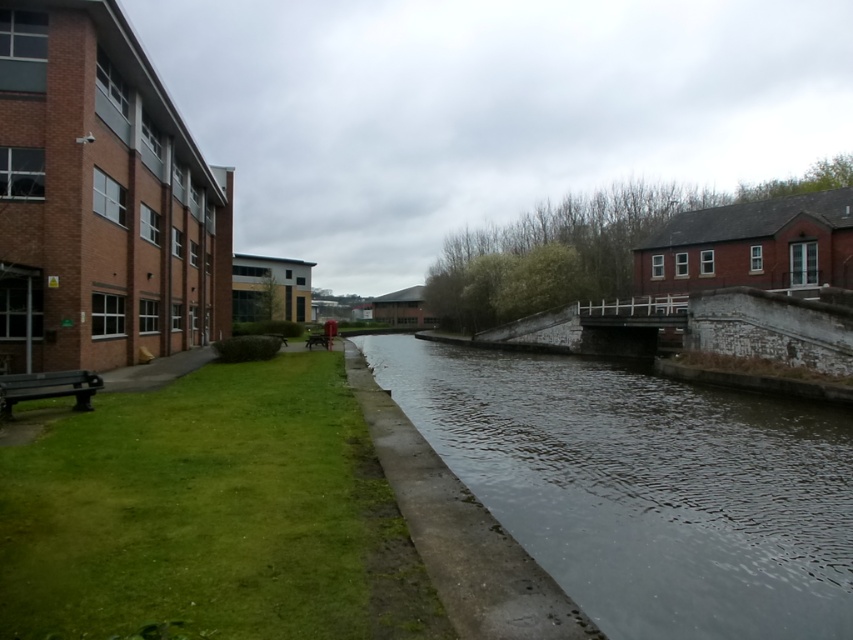
Looking at this image, you are a maintenance worker needing to cross from the green grass at lower left to the clear water at center for inspection. The bridge provided is 6 meters long. Will the bridge be sufficient to span the gap?

The distance between the green grass at lower left and the clear water at center is 6.92 meters. Since the bridge is only 6 meters long, it will not be sufficient to span the gap of 6.92 meters.

From the picture: You are standing at the center of the canal scene. Which direction should you walk to reach the green grass at lower left?

Since the green grass at lower left is located at coordinates point (x=212, y=515), you should walk towards the lower left direction to reach it.

You are a tourist standing at the edge of the canal. You see the green grass at lower left and the clear water at center. Which one is higher in elevation?

The green grass at lower left is above clear water at center, so it has a higher elevation.